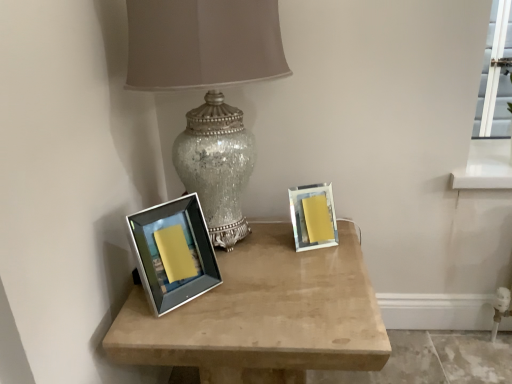
Identify the location of vacant space that is in between silver/metallic picture frame at left, arranged as the 1th picture frame when viewed from the left, and matte silver picture frame at right, positioned as the 1th picture frame in right-to-left order. The height and width of the screenshot is (384, 512). (258, 259).